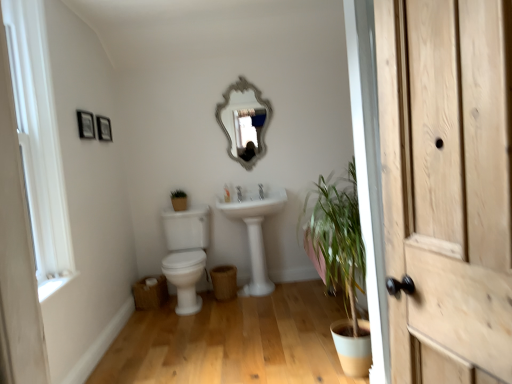
You are a GUI agent. You are given a task and a screenshot of the screen. Output one action in this format:
    pyautogui.click(x=<x>, y=<y>)
    Task: Click on the empty space that is ontop of white glossy toilet at lower left (from a real-world perspective)
    The image size is (512, 384).
    Given the screenshot: What is the action you would take?
    pyautogui.click(x=255, y=330)